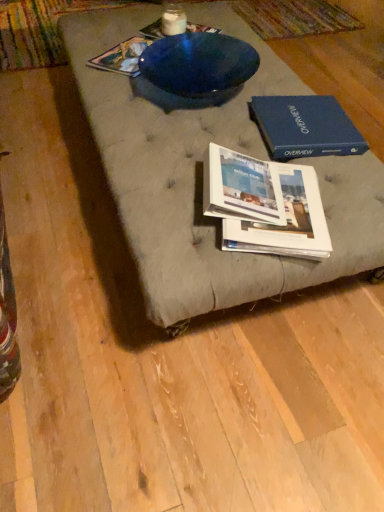
Locate an element on the screen. This screenshot has width=384, height=512. vacant area that is situated to the right of white glossy book at center, arranged as the first book when viewed from the front is located at coordinates (302, 193).